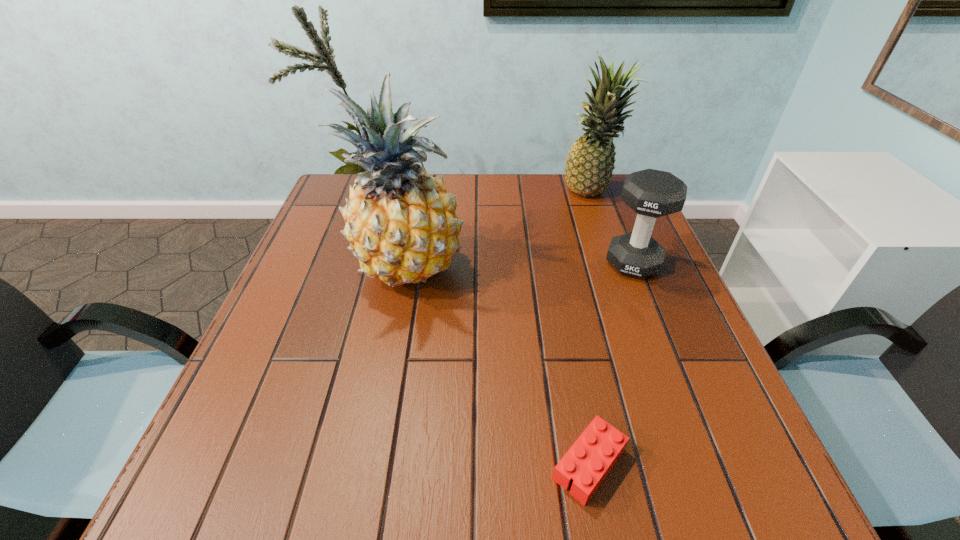
Where is `the nearer pineapple`? This screenshot has height=540, width=960. the nearer pineapple is located at coordinates (401, 224).

I want to click on the left pineapple, so click(x=401, y=224).

Image resolution: width=960 pixels, height=540 pixels. Find the location of `the right pineapple`. the right pineapple is located at coordinates (590, 162).

Identify the location of the farther pineapple. The width and height of the screenshot is (960, 540). (590, 162).

You are a GUI agent. You are given a task and a screenshot of the screen. Output one action in this format:
    pyautogui.click(x=<x>, y=<y>)
    Task: Click on the dumbbell
    Image resolution: width=960 pixels, height=540 pixels.
    Given the screenshot: What is the action you would take?
    pyautogui.click(x=651, y=193)

You are a GUI agent. You are given a task and a screenshot of the screen. Output one action in this format:
    pyautogui.click(x=<x>, y=<y>)
    Task: Click on the Lego
    
    Given the screenshot: What is the action you would take?
    pyautogui.click(x=588, y=461)

Find the location of a particular element. the shortest object is located at coordinates (588, 461).

Image resolution: width=960 pixels, height=540 pixels. Identify the location of vacant space located on the front of the left pineapple. (394, 355).

Identify the location of free location located on the front of the farthest object. The image size is (960, 540). (623, 280).

Identify the location of vacant space situated on the left of the dumbbell. This screenshot has width=960, height=540. (479, 263).